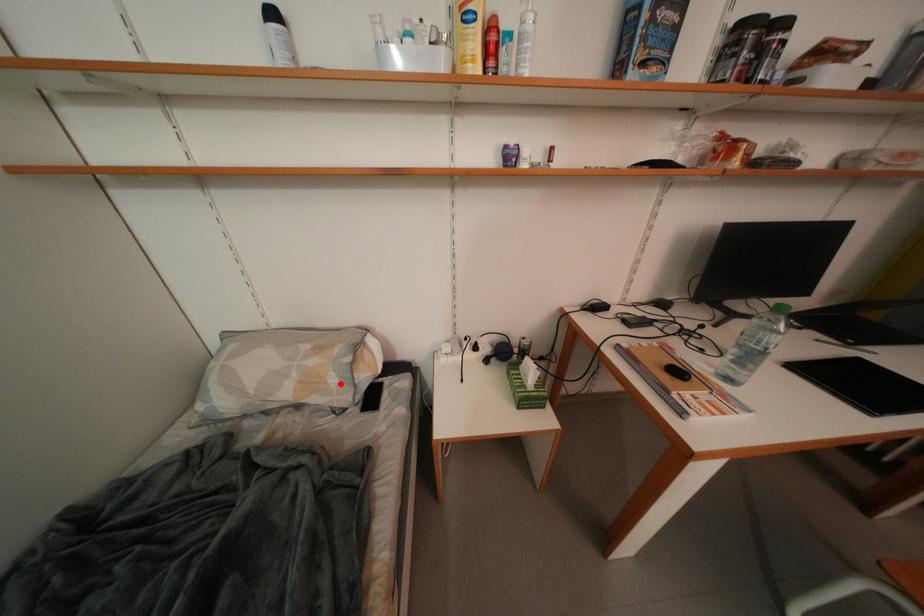
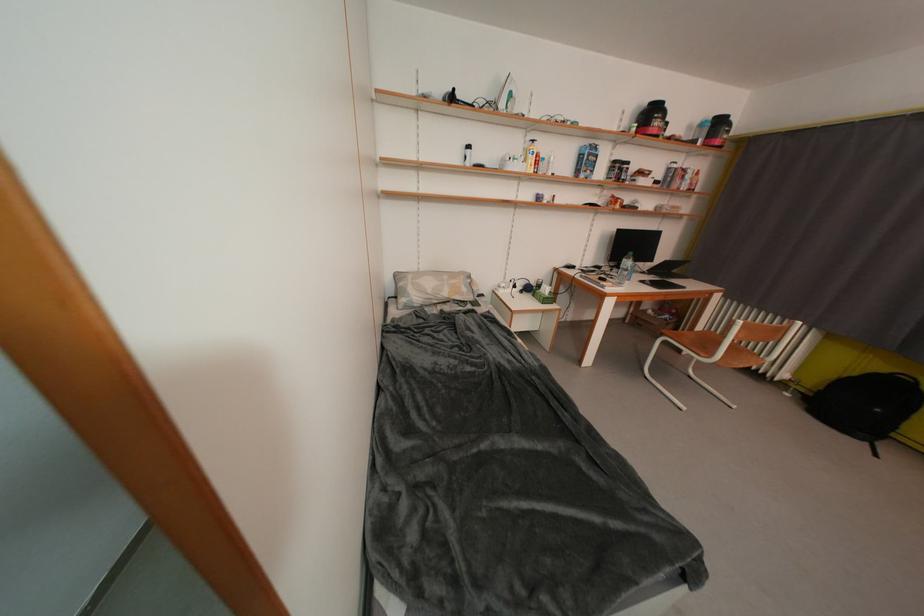
Where in the second image is the point corresponding to the highlighted location from the first image?

(471, 293)